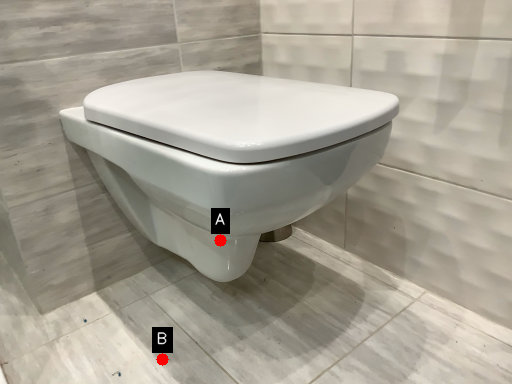
Question: Two points are circled on the image, labeled by A and B beside each circle. Which point appears farthest from the camera in this image?

Choices:
 (A) A is further
 (B) B is further

Answer: (B)